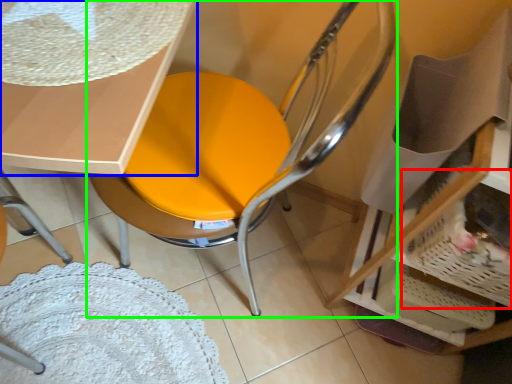
Question: Considering the real-world distances, which object is farthest from basket (highlighted by a red box)? table (highlighted by a blue box) or chair (highlighted by a green box)?

Choices:
 (A) table
 (B) chair

Answer: (A)